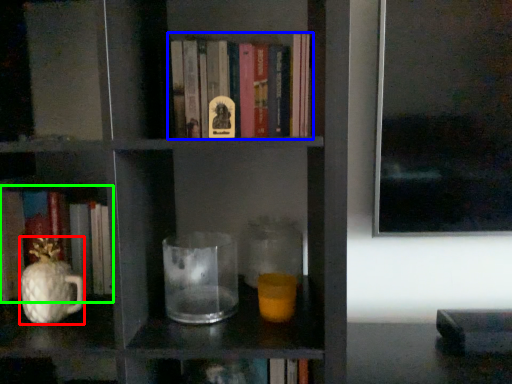
Question: Which object is the closest to the glass vase (highlighted by a red box)? Choose among these: book (highlighted by a blue box) or book (highlighted by a green box).

Choices:
 (A) book
 (B) book

Answer: (B)